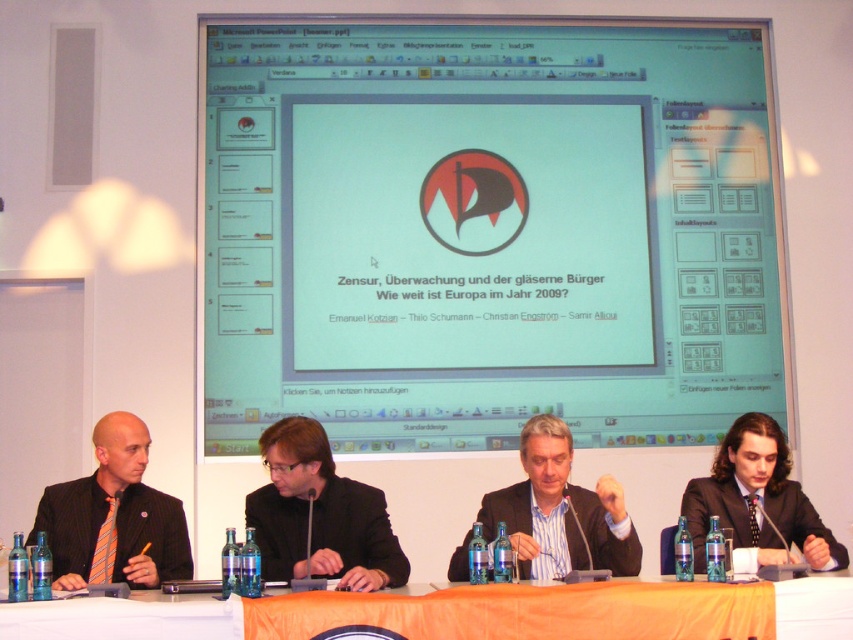
Who is higher up, black suit at center or orange striped tie at left?

black suit at center is above.

Which is more to the left, black suit at center or orange striped tie at left?

From the viewer's perspective, orange striped tie at left appears more on the left side.

Locate an element on the screen. black suit at center is located at coordinates (318, 515).

Based on the photo, which is more to the left, orange fabric table at lower center or dark brown suit at right?

Positioned to the left is orange fabric table at lower center.

Is point (842, 620) behind point (740, 417)?

No, (842, 620) is closer to viewer.

You are a GUI agent. You are given a task and a screenshot of the screen. Output one action in this format:
    pyautogui.click(x=<x>, y=<y>)
    Task: Click on the orange fabric table at lower center
    The image size is (853, 640).
    Given the screenshot: What is the action you would take?
    pyautogui.click(x=125, y=618)

Does point (65, 492) lie in front of point (793, 598)?

That is False.

Between orange striped tie at left and orange fabric table at lower center, which one appears on the left side from the viewer's perspective?

orange striped tie at left

Image resolution: width=853 pixels, height=640 pixels. In order to click on orange striped tie at left in this screenshot , I will do `click(114, 516)`.

The height and width of the screenshot is (640, 853). I want to click on orange striped tie at left, so click(x=114, y=516).